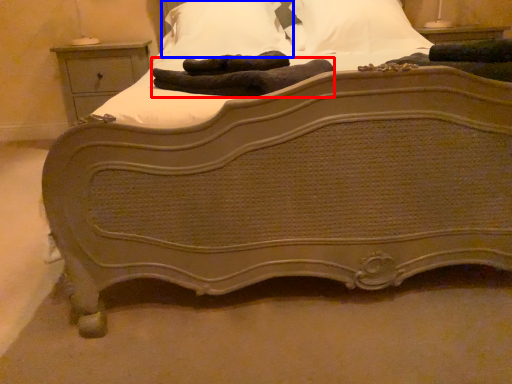
Question: Which of the following is the farthest to the observer, material (highlighted by a red box) or pillow (highlighted by a blue box)?

Choices:
 (A) material
 (B) pillow

Answer: (B)